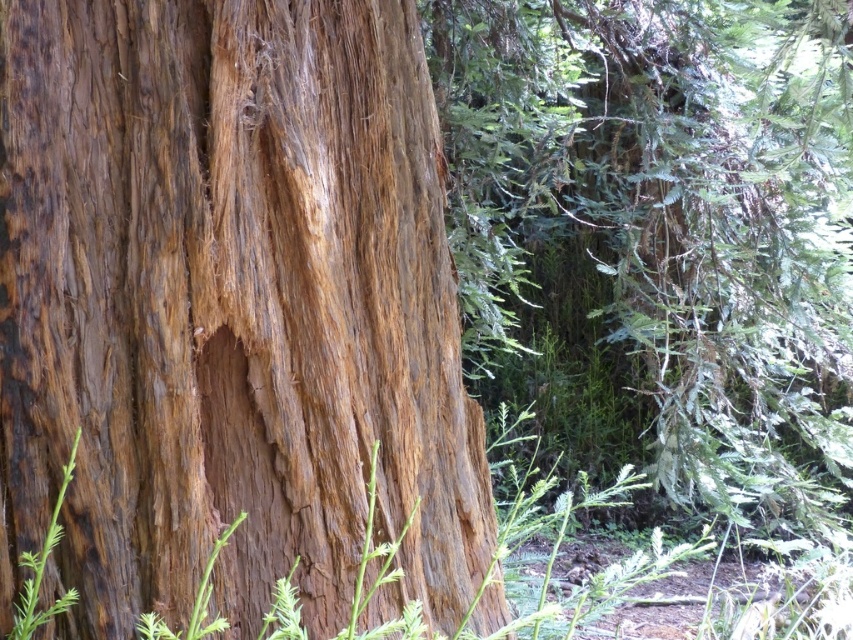
Question: Which of these objects is positioned farthest from the green fuzzy plant at center?

Choices:
 (A) brown rough bark at center
 (B) green fibrous weed at lower left
 (C) green rough stem at lower left

Answer: (C)

Question: Estimate the real-world distances between objects in this image. Which object is closer to the green fuzzy plant at center?

Choices:
 (A) green rough stem at lower left
 (B) brown rough bark at center

Answer: (B)

Question: Is green fuzzy plant at center bigger than green rough stem at lower left?

Choices:
 (A) yes
 (B) no

Answer: (A)

Question: Which of these objects is positioned closest to the green rough stem at lower left?

Choices:
 (A) green fibrous weed at lower left
 (B) green fuzzy plant at center

Answer: (A)

Question: Considering the relative positions of green fuzzy plant at center and green rough stem at lower left in the image provided, where is green fuzzy plant at center located with respect to green rough stem at lower left?

Choices:
 (A) right
 (B) left

Answer: (A)

Question: Is the position of brown rough bark at center less distant than that of green fuzzy plant at center?

Choices:
 (A) no
 (B) yes

Answer: (A)